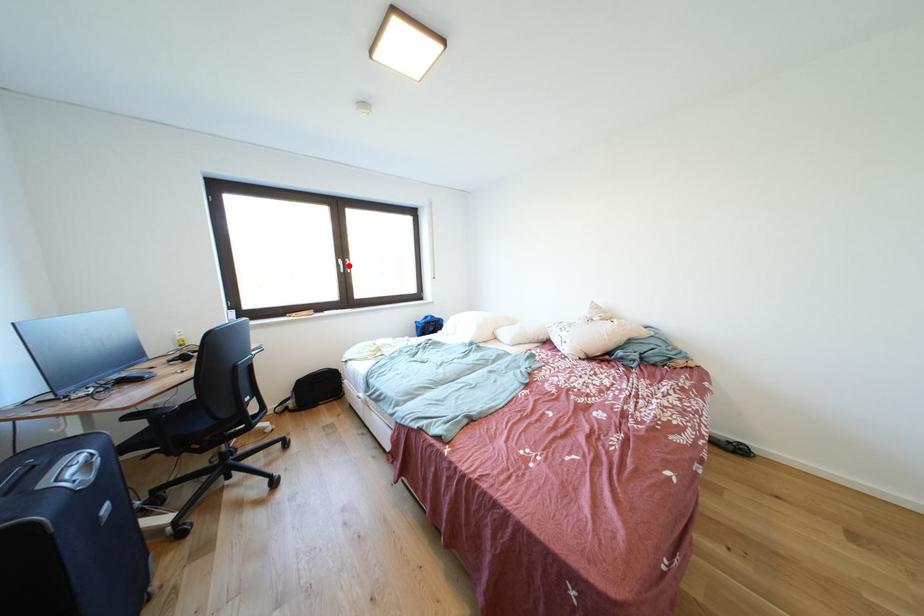
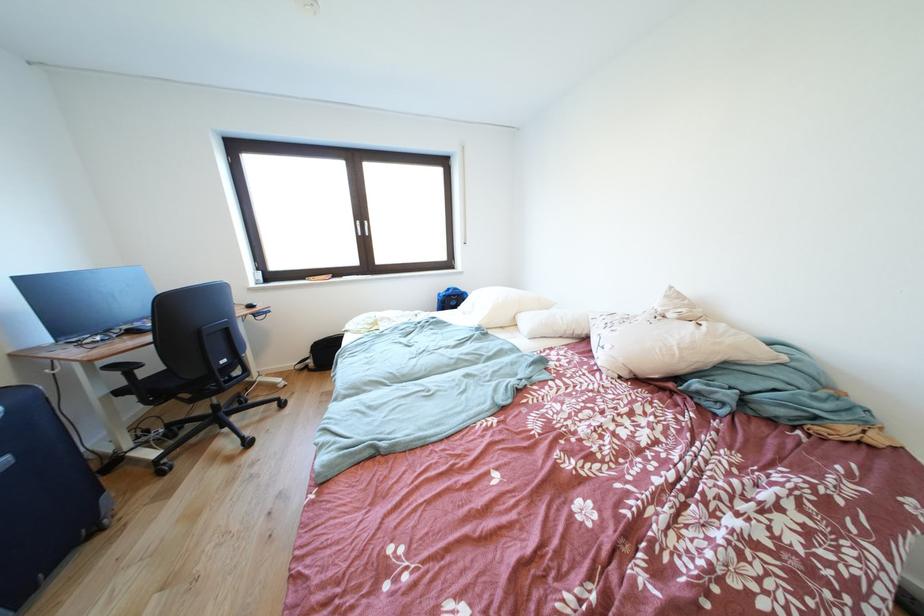
Find the pixel in the second image that matches the highlighted location in the first image.

(367, 228)